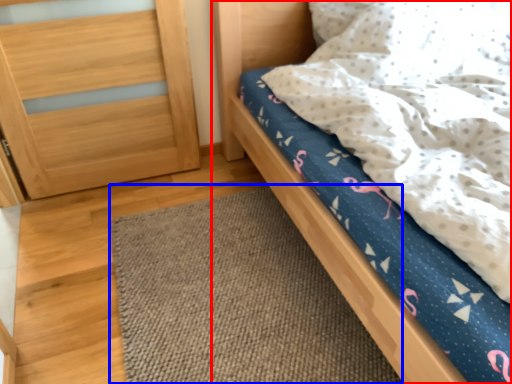
Question: Which point is further to the camera, bed (highlighted by a red box) or mat (highlighted by a blue box)?

Choices:
 (A) bed
 (B) mat

Answer: (B)